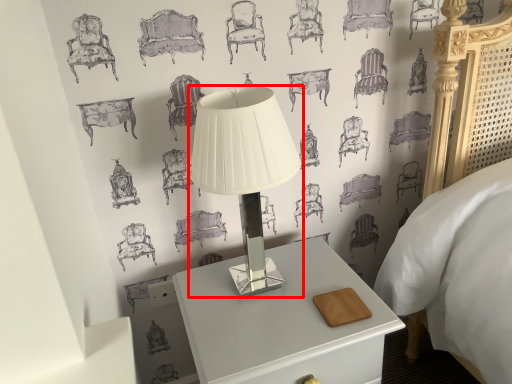
Question: Considering the relative positions of lamp (annotated by the red box) and nightstand in the image provided, where is lamp (annotated by the red box) located with respect to the staircase?

Choices:
 (A) left
 (B) right

Answer: (A)